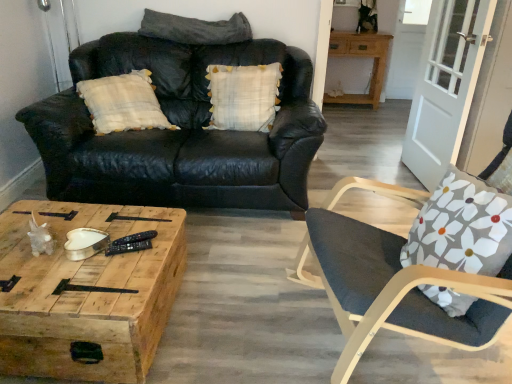
Where is `empty space that is ontop of woodenwoodencoffee table at lower left`? This screenshot has height=384, width=512. empty space that is ontop of woodenwoodencoffee table at lower left is located at coordinates (77, 251).